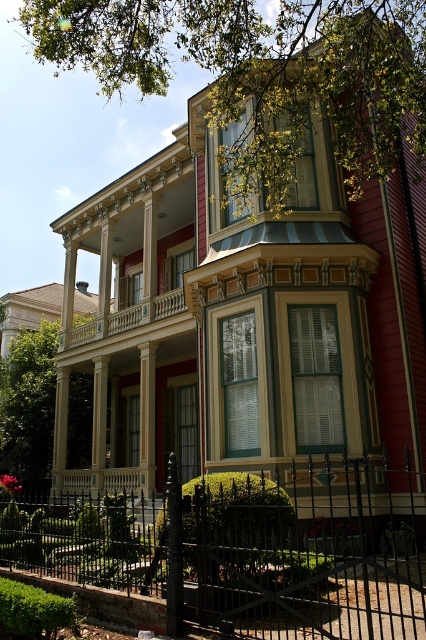
Question: Can you confirm if black wrought iron fence at center is positioned above smooth cream railing at upper center?

Choices:
 (A) no
 (B) yes

Answer: (A)

Question: Can you confirm if black wrought iron fence at center is positioned below smooth cream railing at upper center?

Choices:
 (A) yes
 (B) no

Answer: (A)

Question: Is black wrought iron fence at center above smooth cream railing at upper center?

Choices:
 (A) yes
 (B) no

Answer: (B)

Question: Which object is closer to the camera taking this photo?

Choices:
 (A) black wrought iron fence at center
 (B) smooth cream railing at upper center

Answer: (A)